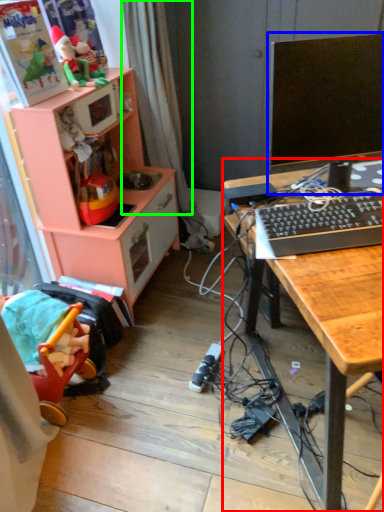
Question: Which is farther away from desk (highlighted by a red box)? computer monitor (highlighted by a blue box) or curtain (highlighted by a green box)?

Choices:
 (A) computer monitor
 (B) curtain

Answer: (B)